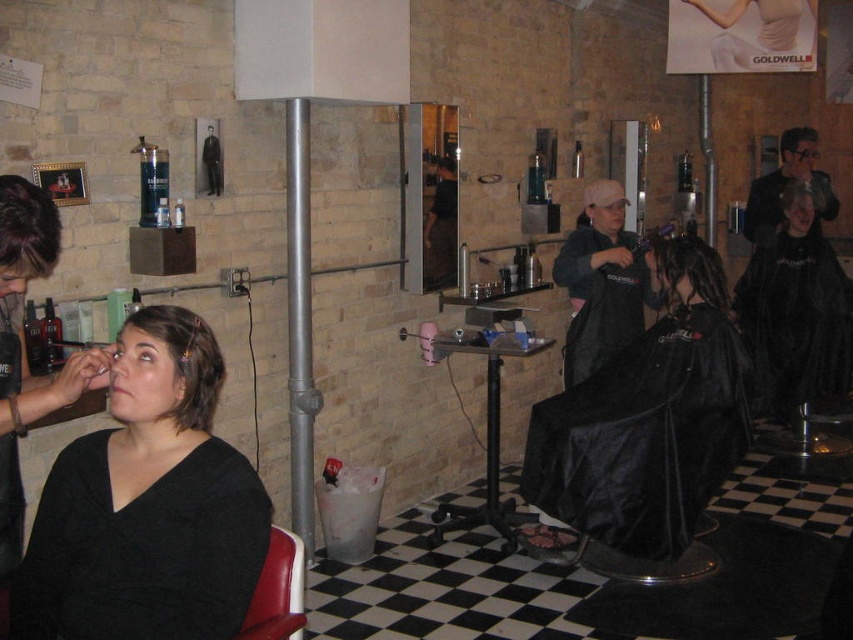
Can you confirm if dark brown leather jacket at upper right is positioned to the left of shiny black hair at center?

Yes, dark brown leather jacket at upper right is to the left of shiny black hair at center.

Does dark brown leather jacket at upper right have a greater height compared to shiny black hair at center?

Yes, dark brown leather jacket at upper right is taller than shiny black hair at center.

Image resolution: width=853 pixels, height=640 pixels. Identify the location of dark brown leather jacket at upper right. (786, 186).

This screenshot has height=640, width=853. I want to click on dark brown leather jacket at upper right, so click(x=786, y=186).

In the scene shown: Does black matte hairdresser cape at center have a lesser width compared to dreadlocks at center?

No, black matte hairdresser cape at center is not thinner than dreadlocks at center.

Does black matte hairdresser cape at center have a greater width compared to dreadlocks at center?

Yes, black matte hairdresser cape at center is wider than dreadlocks at center.

Is point (798, 232) farther from viewer compared to point (694, 244)?

Yes, point (798, 232) is farther from viewer.

This screenshot has height=640, width=853. Identify the location of black matte hairdresser cape at center. (795, 310).

Which of these two, dark brown leather jacket at upper right or red leather chair at lower left, stands taller?

Standing taller between the two is dark brown leather jacket at upper right.

Does point (831, 204) lie in front of point (259, 632)?

No, it is not.

Is point (775, 168) farther from viewer compared to point (265, 582)?

That is True.

The height and width of the screenshot is (640, 853). I want to click on dark brown leather jacket at upper right, so click(786, 186).